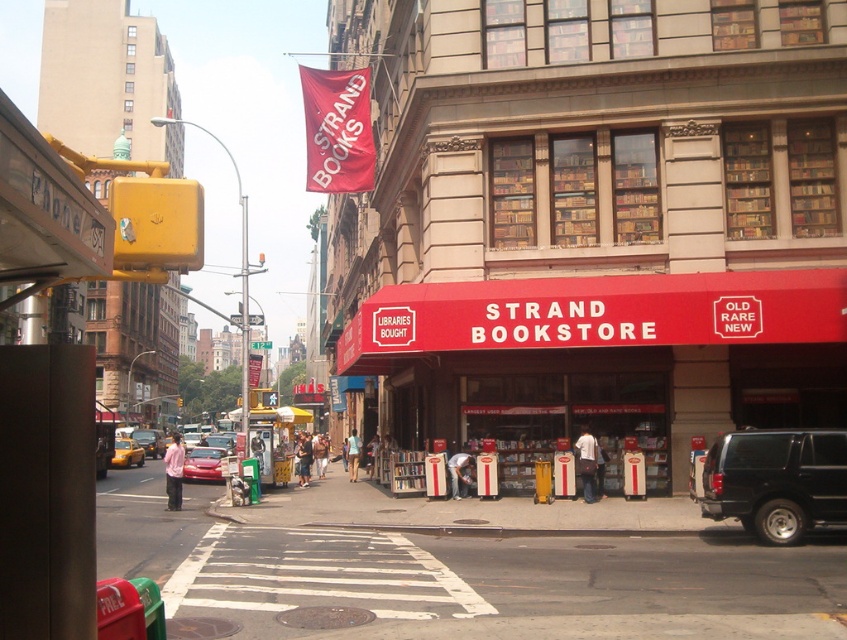
Describe the element at coordinates (595, 218) in the screenshot. I see `red matte awning at center` at that location.

Does red matte awning at center have a lesser width compared to yellow matte taxi cab at left?

No.

What do you see at coordinates (595, 218) in the screenshot?
I see `red matte awning at center` at bounding box center [595, 218].

Locate an element on the screen. red matte awning at center is located at coordinates (595, 218).

Can you confirm if red matte awning at center is wider than black matte suv at center-right?

Correct, the width of red matte awning at center exceeds that of black matte suv at center-right.

Where is `red matte awning at center`? red matte awning at center is located at coordinates (595, 218).

I want to click on red matte awning at center, so click(595, 218).

This screenshot has height=640, width=847. Find the location of `red matte awning at center`. red matte awning at center is located at coordinates (595, 218).

Is point (721, 458) positioned behind point (208, 449)?

No, (721, 458) is in front of (208, 449).

Does black matte suv at center-right appear over shiny red sedan at center?

Correct, black matte suv at center-right is located above shiny red sedan at center.

Identify the location of black matte suv at center-right. (776, 481).